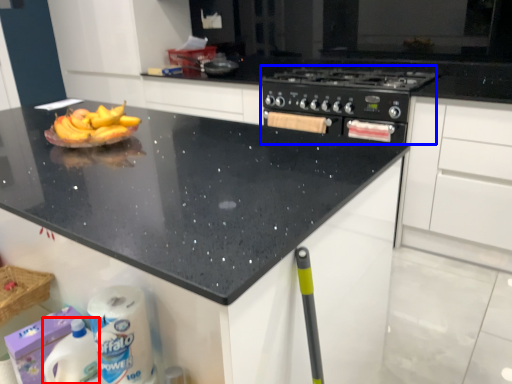
Question: Which point is further to the camera, cleaning product (highlighted by a red box) or appliance (highlighted by a blue box)?

Choices:
 (A) cleaning product
 (B) appliance

Answer: (B)